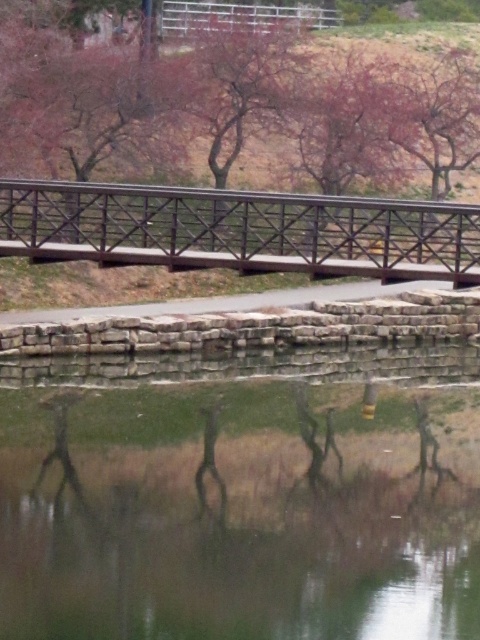
Between transparent water at lower center and black metal bridge at center, which one appears on the right side from the viewer's perspective?

From the viewer's perspective, black metal bridge at center appears more on the right side.

Is transparent water at lower center to the left of black metal bridge at center from the viewer's perspective?

Indeed, transparent water at lower center is positioned on the left side of black metal bridge at center.

Identify the location of transparent water at lower center. (238, 548).

Does smooth pink tree at center have a greater height compared to black metal bridge at center?

Yes, smooth pink tree at center is taller than black metal bridge at center.

Is smooth pink tree at center positioned at the back of black metal bridge at center?

Yes, it is behind black metal bridge at center.

In order to click on smooth pink tree at center in this screenshot , I will do `click(237, 141)`.

The height and width of the screenshot is (640, 480). In order to click on smooth pink tree at center in this screenshot , I will do `click(237, 141)`.

Does smooth pink tree at center appear over transparent water at lower center?

Yes, smooth pink tree at center is above transparent water at lower center.

Does smooth pink tree at center have a greater width compared to transparent water at lower center?

Yes.

Who is more distant from viewer, [195,212] or [317,611]?

Positioned behind is point [195,212].

This screenshot has height=640, width=480. I want to click on smooth pink tree at center, so click(x=237, y=141).